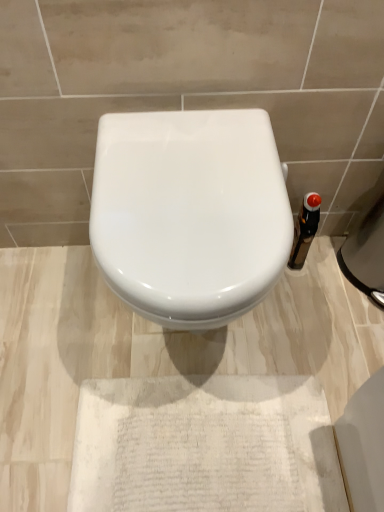
Question: Should I look upward or downward to see black glass bottle at right?

Choices:
 (A) up
 (B) down

Answer: (A)

Question: From a real-world perspective, is white glossy toilet at center on black glass bottle at right?

Choices:
 (A) no
 (B) yes

Answer: (B)

Question: Can you see white glossy toilet at center touching black glass bottle at right?

Choices:
 (A) yes
 (B) no

Answer: (B)

Question: Is white glossy toilet at center to the left of black glass bottle at right from the viewer's perspective?

Choices:
 (A) yes
 (B) no

Answer: (A)

Question: Is white glossy toilet at center smaller than black glass bottle at right?

Choices:
 (A) yes
 (B) no

Answer: (B)

Question: From a real-world perspective, is white glossy toilet at center located beneath black glass bottle at right?

Choices:
 (A) yes
 (B) no

Answer: (B)

Question: Is white glossy toilet at center wider than black glass bottle at right?

Choices:
 (A) no
 (B) yes

Answer: (B)

Question: Is black glass bottle at right facing away from white glossy toilet at center?

Choices:
 (A) yes
 (B) no

Answer: (B)

Question: From a real-world perspective, is black glass bottle at right located beneath white glossy toilet at center?

Choices:
 (A) no
 (B) yes

Answer: (B)

Question: Can you confirm if black glass bottle at right is thinner than white glossy toilet at center?

Choices:
 (A) no
 (B) yes

Answer: (B)

Question: Is black glass bottle at right positioned behind white glossy toilet at center?

Choices:
 (A) yes
 (B) no

Answer: (A)

Question: Is black glass bottle at right not within white glossy toilet at center?

Choices:
 (A) yes
 (B) no

Answer: (A)

Question: Is black glass bottle at right far from white glossy toilet at center?

Choices:
 (A) yes
 (B) no

Answer: (B)

Question: In terms of width, does black glass bottle at right look wider or thinner when compared to white glossy toilet at center?

Choices:
 (A) thin
 (B) wide

Answer: (A)